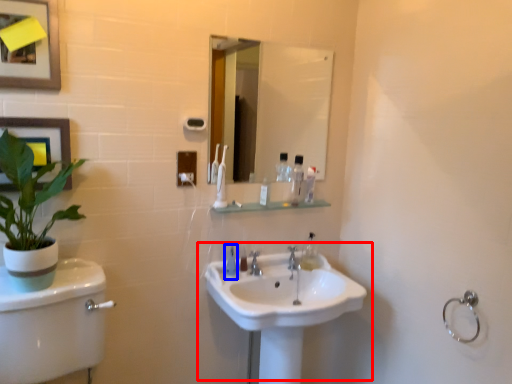
Question: Among these objects, which one is farthest to the camera, sink (highlighted by a red box) or mouthwash (highlighted by a blue box)?

Choices:
 (A) sink
 (B) mouthwash

Answer: (B)